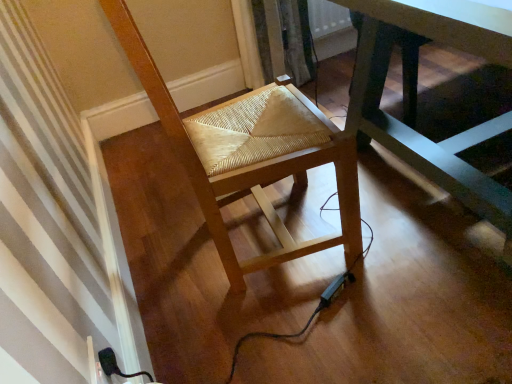
Where is `vacant space that is to the left of natural wood woven seat at center`? vacant space that is to the left of natural wood woven seat at center is located at coordinates (159, 255).